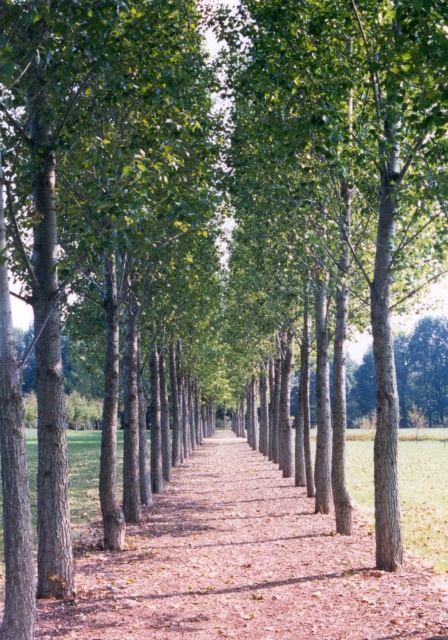
You are standing on the path and want to touch the tree trunk. Which one is closer to you, the smooth bark tree at center or the brown bark path at center?

The smooth bark tree at center is closer to the viewer than the brown bark path at center, so you can reach it first.

You are standing at the entrance of the tree lined path and want to know which object is taller between the smooth bark tree at center and the brown bark path at center. Which one is taller?

The smooth bark tree at center is taller than the brown bark path at center.